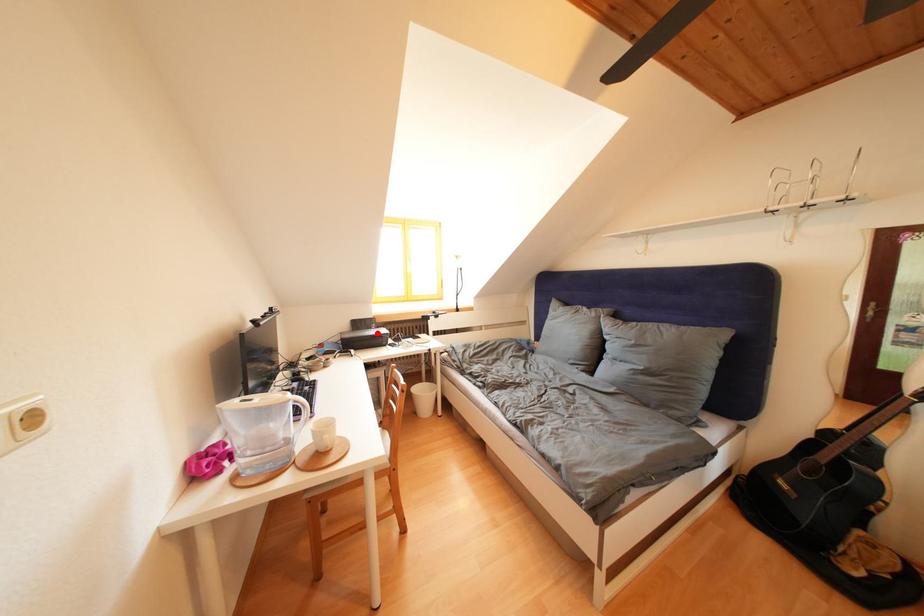
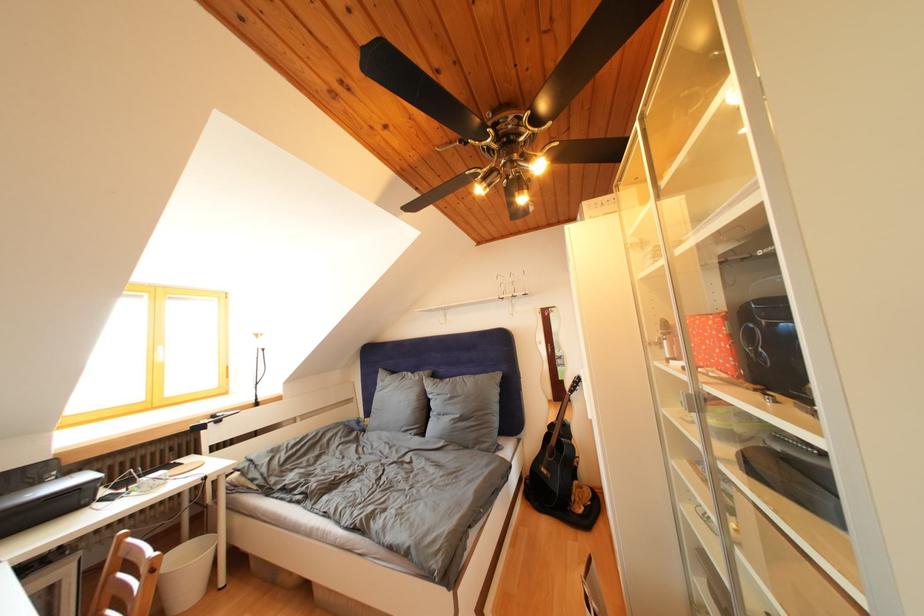
In the second image, find the point that corresponds to the highlighted location in the first image.

(44, 488)